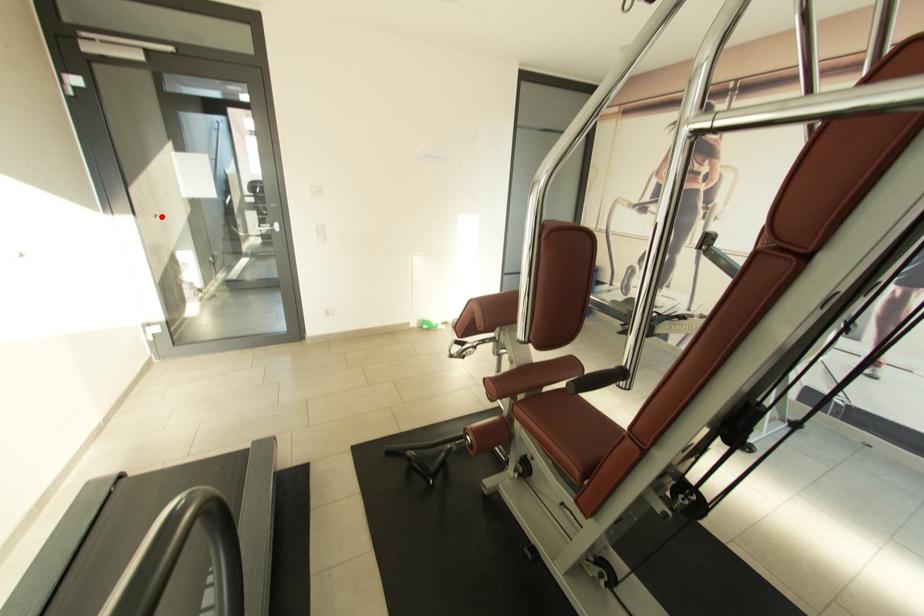
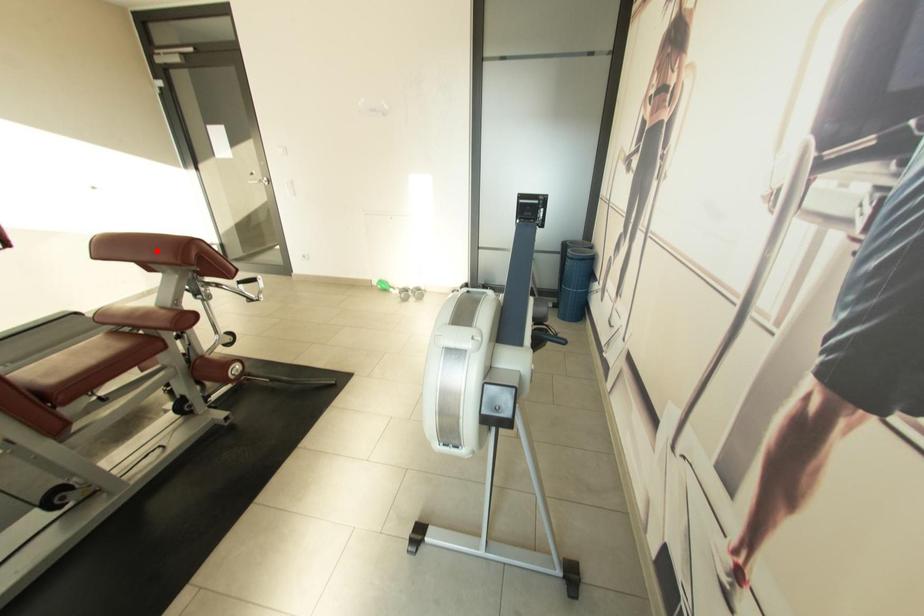
Based on the photo, I am providing you with two images of the same scene from different viewpoints. A red point is marked on the first image and another point is marked on the second image. Is the marked point in image1 the same physical position as the marked point in image2?

No